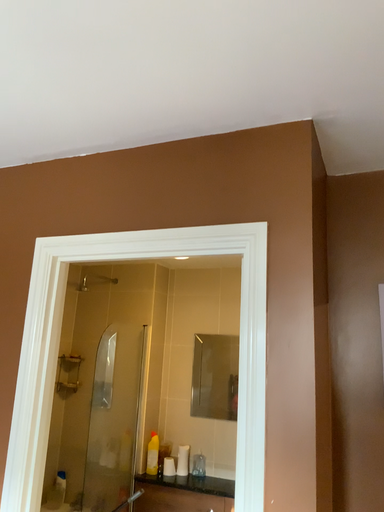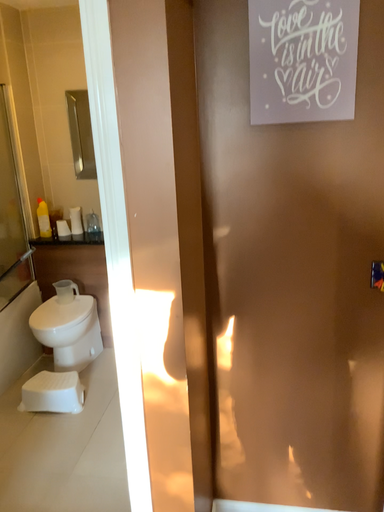
Question: How did the camera likely rotate when shooting the video?

Choices:
 (A) rotated upward
 (B) rotated downward

Answer: (B)